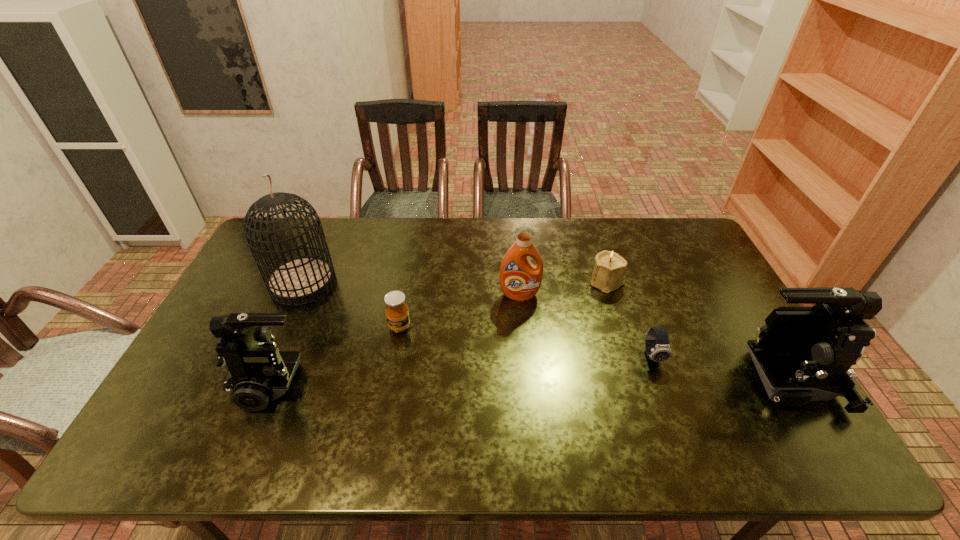
I want to click on object located at the near right corner, so click(x=802, y=354).

You are a GUI agent. You are given a task and a screenshot of the screen. Output one action in this format:
    pyautogui.click(x=<x>, y=<y>)
    Task: Click on the vacant space at the far edge
    This screenshot has width=960, height=540.
    Given the screenshot: What is the action you would take?
    pyautogui.click(x=551, y=226)

You are a GUI agent. You are given a task and a screenshot of the screen. Output one action in this format:
    pyautogui.click(x=<x>, y=<y>)
    Task: Click on the free space at the near edge of the desktop
    
    Given the screenshot: What is the action you would take?
    pyautogui.click(x=305, y=409)

The width and height of the screenshot is (960, 540). I want to click on free region at the left edge of the desktop, so click(x=243, y=286).

In the image, there is a desktop. Identify the location of vacant space at the far left corner. The width and height of the screenshot is (960, 540). (265, 235).

This screenshot has height=540, width=960. I want to click on free space at the near left corner of the desktop, so click(180, 407).

This screenshot has height=540, width=960. Identify the location of free location at the far right corner. (675, 234).

This screenshot has width=960, height=540. I want to click on vacant area between the candle_holder and the second tallest object, so click(695, 331).

This screenshot has height=540, width=960. I want to click on blank region between the watch and the taller camcorder, so tap(718, 368).

At what (x,y) coordinates should I click in order to perform the action: click on vacant area between the second tallest object and the shortest object. Please return your answer as a coordinate pair (x, y). Looking at the image, I should click on (718, 368).